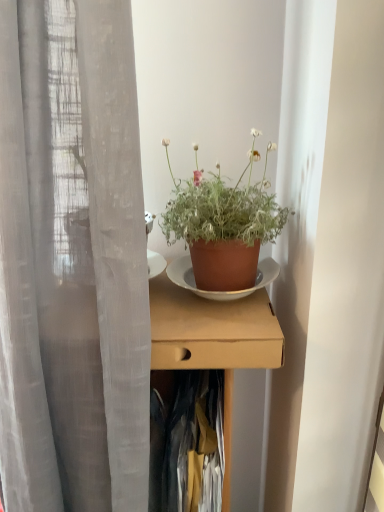
Question: In terms of size, does brown cardboard box at center appear bigger or smaller than terracotta pot at center?

Choices:
 (A) small
 (B) big

Answer: (B)

Question: From a real-world perspective, relative to terracotta pot at center, is brown cardboard box at center vertically above or below?

Choices:
 (A) above
 (B) below

Answer: (B)

Question: Which of these objects is positioned closest to the terracotta pot at center?

Choices:
 (A) dark blue fabric at center
 (B) brown cardboard box at center

Answer: (B)

Question: Based on their relative distances, which object is farther from the brown cardboard box at center?

Choices:
 (A) terracotta pot at center
 (B) dark blue fabric at center

Answer: (A)